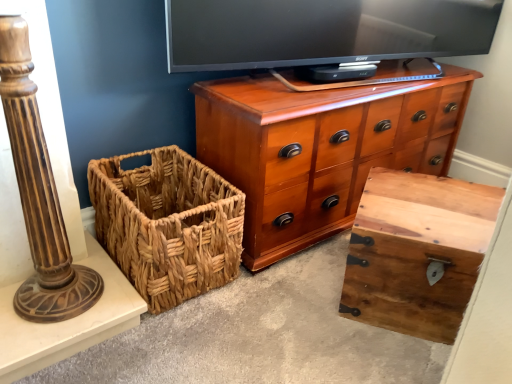
Question: From a real-world perspective, is brown polished wood column at left on top of rustic wood trunk at center?

Choices:
 (A) yes
 (B) no

Answer: (A)

Question: Does brown polished wood column at left have a larger size compared to rustic wood trunk at center?

Choices:
 (A) yes
 (B) no

Answer: (B)

Question: Can you confirm if brown polished wood column at left is thinner than rustic wood trunk at center?

Choices:
 (A) yes
 (B) no

Answer: (A)

Question: Can you see brown polished wood column at left touching rustic wood trunk at center?

Choices:
 (A) no
 (B) yes

Answer: (A)

Question: Is rustic wood trunk at center inside brown polished wood column at left?

Choices:
 (A) yes
 (B) no

Answer: (B)

Question: Is shiny wood chest of drawers at center spatially inside brown polished wood column at left, or outside of it?

Choices:
 (A) outside
 (B) inside

Answer: (A)

Question: From the image's perspective, relative to brown polished wood column at left, is shiny wood chest of drawers at center above or below?

Choices:
 (A) above
 (B) below

Answer: (A)

Question: In the image, is shiny wood chest of drawers at center on the left side or the right side of brown polished wood column at left?

Choices:
 (A) right
 (B) left

Answer: (A)

Question: In terms of width, does shiny wood chest of drawers at center look wider or thinner when compared to brown polished wood column at left?

Choices:
 (A) thin
 (B) wide

Answer: (B)

Question: From a real-world perspective, is rustic wood trunk at center above or below brown polished wood column at left?

Choices:
 (A) above
 (B) below

Answer: (B)

Question: From the image's perspective, is rustic wood trunk at center located above or below brown polished wood column at left?

Choices:
 (A) below
 (B) above

Answer: (A)

Question: Considering the positions of rustic wood trunk at center and brown polished wood column at left in the image, is rustic wood trunk at center bigger or smaller than brown polished wood column at left?

Choices:
 (A) small
 (B) big

Answer: (B)

Question: Is rustic wood trunk at center in front of or behind brown polished wood column at left in the image?

Choices:
 (A) behind
 (B) front

Answer: (A)

Question: Looking at their shapes, would you say woven brown basket at lower left is wider or thinner than shiny wood chest of drawers at center?

Choices:
 (A) thin
 (B) wide

Answer: (B)

Question: Is woven brown basket at lower left to the left or to the right of shiny wood chest of drawers at center in the image?

Choices:
 (A) left
 (B) right

Answer: (A)